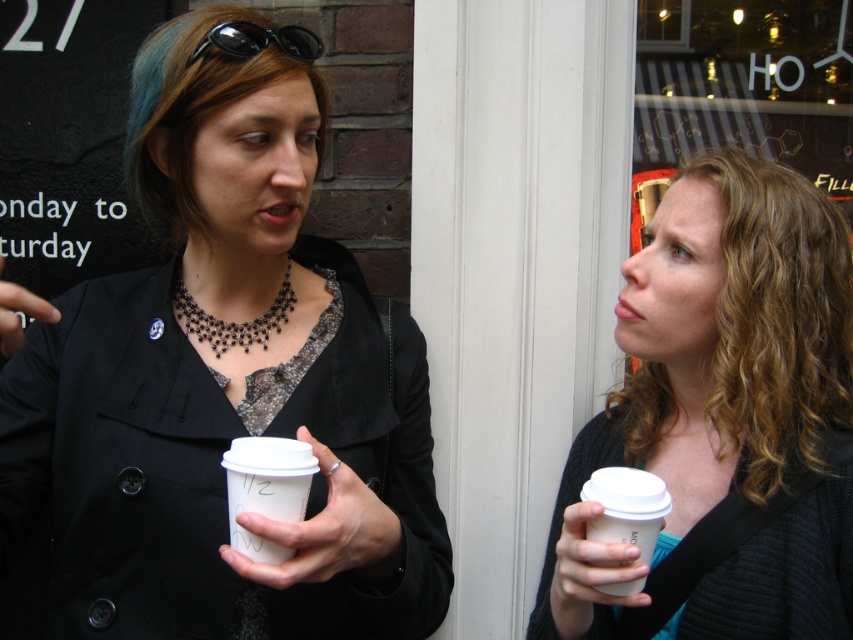
You are designing a display case for small accessories. The case has two compartments, one for necklaces and another for goggles. The necklace compartment requires items to be smaller than 15 cm in diameter, and the goggles compartment must hold items smaller than 10 cm. Based on the image, will the black beaded necklace at center and the black rubber goggles at upper left fit into their respective compartments?

The black beaded necklace at center is bigger than the black rubber goggles at upper left. Since the necklace compartment requires items smaller than 15 cm, but the necklace is larger than the goggles, which are under 10 cm, the necklace might still fit if its diameter is under 15 cm. However, without exact measurements, we can only confirm the goggles would fit in their compartment if they are under 10 cm. The necklace may or may not fit depending on its actual size.

You are standing in front of the brick wall and want to place a small sticker on the closer of the two points, point (x=614, y=451) and point (x=618, y=472). Which point should you choose?

Point (x=618, y=472) is closer to you than point (x=614, y=451), so you should place the sticker on point (x=618, y=472).

Based on the photo, you are a barista trying to place two matte black coffee cups on a shelf. The shelf has a width of 12 inches. If the matte black coffee cup at center is 6 inches wide and the matte black coffee cup at right is 5 inches wide, will both fit side by side on the shelf?

The matte black coffee cup at center is 6 inches wide and the matte black coffee cup at right is 5 inches wide. Combined, they total 11 inches, which is less than the 12 inch shelf width. Therefore, both can fit side by side on the shelf.